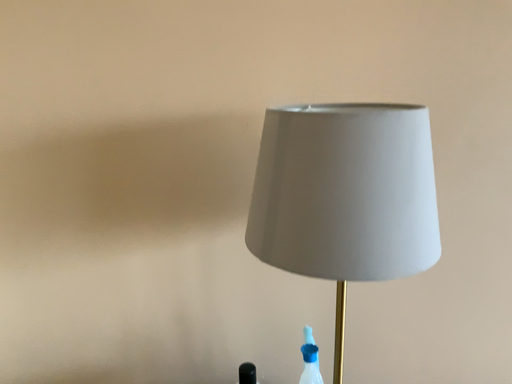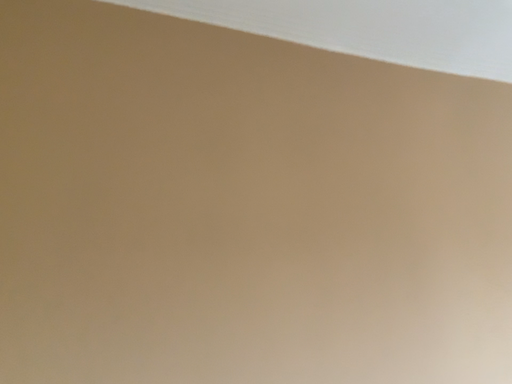
Question: How did the camera likely rotate when shooting the video?

Choices:
 (A) rotated left
 (B) rotated right

Answer: (B)